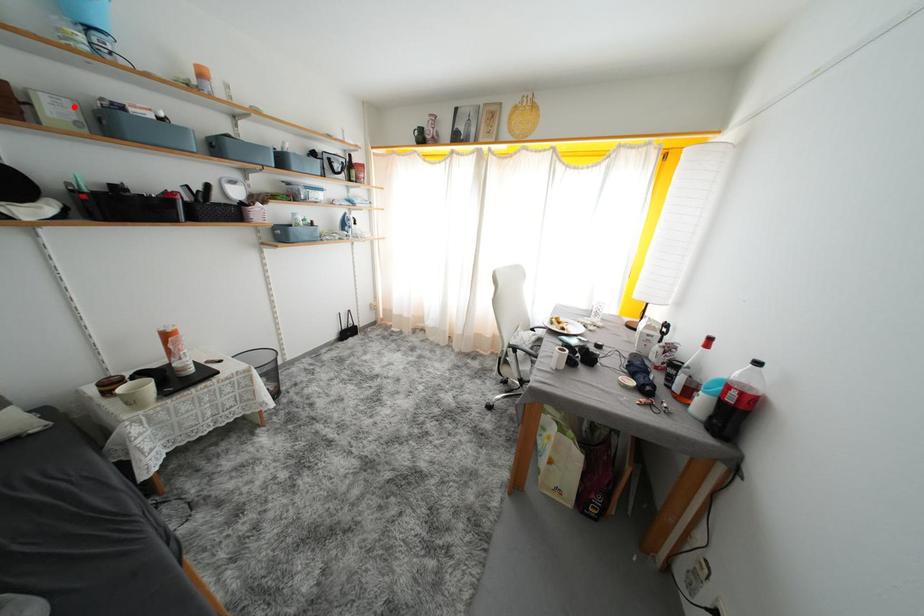
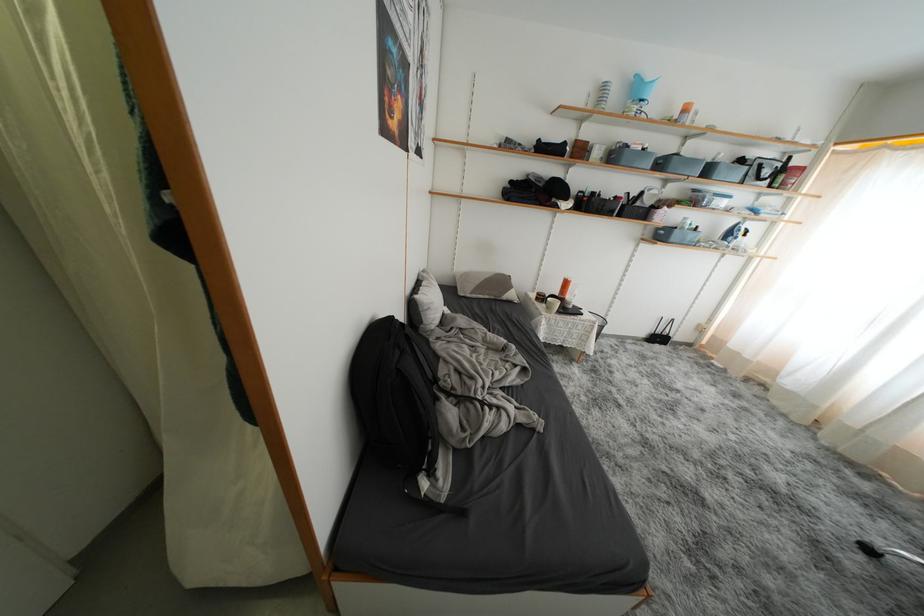
The point at the highlighted location is marked in the first image. Where is the corresponding point in the second image?

(610, 152)